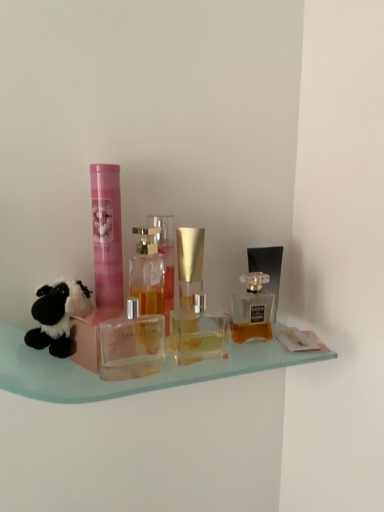
Where is `transparent glass perfume bottle at center, which appears as the third bottle when viewed from the left`? This screenshot has width=384, height=512. transparent glass perfume bottle at center, which appears as the third bottle when viewed from the left is located at coordinates (198, 333).

At what (x,y) coordinates should I click in order to perform the action: click on matte glass perfume bottle at center, positioned as the 4th bottle in left-to-right order. Please return your answer as a coordinate pair (x, y). This screenshot has width=384, height=512. Looking at the image, I should click on (252, 310).

Where is `black plush toy at left`? black plush toy at left is located at coordinates (58, 316).

Locate an element on the screen. Image resolution: width=384 pixels, height=512 pixels. clear glass perfume bottle at center, which is the 1th bottle from left to right is located at coordinates (147, 272).

Where is `transparent glass perfume bottle at center, which appears as the third bottle when viewed from the left`? This screenshot has width=384, height=512. transparent glass perfume bottle at center, which appears as the third bottle when viewed from the left is located at coordinates (198, 333).

Considering the relative positions of clear glass perfume bottle at center, positioned as the fourth bottle in right-to-left order, and matte glass perfume bottle at center, which ranks as the first bottle in right-to-left order, in the image provided, is clear glass perfume bottle at center, positioned as the fourth bottle in right-to-left order, in front of matte glass perfume bottle at center, which ranks as the first bottle in right-to-left order,?

Yes, clear glass perfume bottle at center, positioned as the fourth bottle in right-to-left order, is closer to the viewer.

Is point (141, 275) positioned behind point (252, 322)?

No, it is not.

Is clear glass perfume bottle at center, which is the 1th bottle from left to right, beside matte glass perfume bottle at center, positioned as the 4th bottle in left-to-right order?

No.

Visually, is pink matte tube at center, the second toiletry viewed from the right, positioned to the left or to the right of clear glass perfume bottle at center, which appears as the 3th bottle when viewed from the right?

pink matte tube at center, the second toiletry viewed from the right, is to the left of clear glass perfume bottle at center, which appears as the 3th bottle when viewed from the right.

Is pink matte tube at center, which ranks as the first toiletry in front-to-back order, in contact with clear glass perfume bottle at center, positioned as the second bottle in left-to-right order?

Indeed, pink matte tube at center, which ranks as the first toiletry in front-to-back order, and clear glass perfume bottle at center, positioned as the second bottle in left-to-right order, are beside each other and touching.

Considering the sizes of objects pink matte tube at center, the second toiletry viewed from the right, and clear glass perfume bottle at center, positioned as the second bottle in left-to-right order, in the image provided, who is shorter, pink matte tube at center, the second toiletry viewed from the right, or clear glass perfume bottle at center, positioned as the second bottle in left-to-right order,?

clear glass perfume bottle at center, positioned as the second bottle in left-to-right order, is shorter.

How much distance is there between pink matte tube at center, marked as the 1th toiletry in a left-to-right arrangement, and clear glass perfume bottle at center, which appears as the 3th bottle when viewed from the right?

pink matte tube at center, marked as the 1th toiletry in a left-to-right arrangement, and clear glass perfume bottle at center, which appears as the 3th bottle when viewed from the right, are 3.68 inches apart.

In the scene shown: From a real-world perspective, which is physically below, matte glass perfume bottle at center, positioned as the 4th bottle in left-to-right order, or pink matte tube at center, marked as the 1th toiletry in a left-to-right arrangement?

From a 3D spatial view, matte glass perfume bottle at center, positioned as the 4th bottle in left-to-right order, is below.

Between matte glass perfume bottle at center, which ranks as the first bottle in right-to-left order, and pink matte tube at center, the second toiletry viewed from the right, which one has more height?

With more height is pink matte tube at center, the second toiletry viewed from the right.

Is matte glass perfume bottle at center, which ranks as the first bottle in right-to-left order, closer to the viewer compared to pink matte tube at center, which is the 2th toiletry from back to front?

No.

From a real-world perspective, is clear glass perfume bottle at center, which is the 1th bottle from left to right, under pink matte tube at center, the second toiletry viewed from the right?

Yes.

Is clear glass perfume bottle at center, positioned as the fourth bottle in right-to-left order, directly adjacent to pink matte tube at center, which is the 2th toiletry from back to front?

Yes, clear glass perfume bottle at center, positioned as the fourth bottle in right-to-left order, is beside pink matte tube at center, which is the 2th toiletry from back to front.

Considering the positions of points (164, 271) and (104, 170), is point (164, 271) closer to camera compared to point (104, 170)?

No, it is not.

Is clear glass perfume bottle at center, positioned as the fourth bottle in right-to-left order, not within pink matte tube at center, marked as the 1th toiletry in a left-to-right arrangement?

Absolutely, clear glass perfume bottle at center, positioned as the fourth bottle in right-to-left order, is external to pink matte tube at center, marked as the 1th toiletry in a left-to-right arrangement.

From the image's perspective, does clear glass perfume bottle at center, positioned as the second bottle in left-to-right order, appear higher than black plush toy at left?

Yes.

Can you confirm if clear glass perfume bottle at center, positioned as the second bottle in left-to-right order, is shorter than black plush toy at left?

Incorrect, the height of clear glass perfume bottle at center, positioned as the second bottle in left-to-right order, does not fall short of that of black plush toy at left.

Which object is thinner, clear glass perfume bottle at center, which appears as the 3th bottle when viewed from the right, or black plush toy at left?

clear glass perfume bottle at center, which appears as the 3th bottle when viewed from the right.

From a real-world perspective, is clear glass perfume bottle at center, which appears as the 3th bottle when viewed from the right, positioned under matte black perfume at right, the 1th toiletry from the back, based on gravity?

No.

From the image's perspective, is clear glass perfume bottle at center, which appears as the 3th bottle when viewed from the right, positioned above or below matte black perfume at right, which is counted as the 2th toiletry, starting from the left?

From the image's perspective, clear glass perfume bottle at center, which appears as the 3th bottle when viewed from the right, appears above matte black perfume at right, which is counted as the 2th toiletry, starting from the left.

Could you measure the distance between clear glass perfume bottle at center, positioned as the second bottle in left-to-right order, and matte black perfume at right, the 1th toiletry from the back?

clear glass perfume bottle at center, positioned as the second bottle in left-to-right order, and matte black perfume at right, the 1th toiletry from the back, are 18.67 centimeters apart.

Does point (165, 303) appear closer or farther from the camera than point (248, 250)?

Clearly, point (165, 303) is closer to the camera than point (248, 250).

Based on the photo, considering the sizes of transparent glass perfume bottle at center, which appears as the third bottle when viewed from the left, and clear glass perfume bottle at center, positioned as the second bottle in left-to-right order, in the image, is transparent glass perfume bottle at center, which appears as the third bottle when viewed from the left, wider or thinner than clear glass perfume bottle at center, positioned as the second bottle in left-to-right order,?

Considering their sizes, transparent glass perfume bottle at center, which appears as the third bottle when viewed from the left, looks broader than clear glass perfume bottle at center, positioned as the second bottle in left-to-right order.

In the scene shown: Is transparent glass perfume bottle at center, which is counted as the 2th bottle, starting from the right, oriented away from clear glass perfume bottle at center, positioned as the second bottle in left-to-right order?

Yes.

In terms of size, does transparent glass perfume bottle at center, which appears as the third bottle when viewed from the left, appear bigger or smaller than clear glass perfume bottle at center, which appears as the 3th bottle when viewed from the right?

transparent glass perfume bottle at center, which appears as the third bottle when viewed from the left, is bigger than clear glass perfume bottle at center, which appears as the 3th bottle when viewed from the right.

From the matte glass perfume bottle at center, positioned as the 4th bottle in left-to-right order, count 1st bottles forward and point to it. Please provide its 2D coordinates.

[(147, 272)]

The height and width of the screenshot is (512, 384). Identify the location of toiletry that is above the clear glass perfume bottle at center, positioned as the second bottle in left-to-right order (from the image's perspective). (107, 234).

Based on their spatial positions, is matte glass perfume bottle at center, positioned as the 4th bottle in left-to-right order, or matte black perfume at right, acting as the first toiletry starting from the right, further from transparent glass perfume bottle at center, which appears as the third bottle when viewed from the left?

matte black perfume at right, acting as the first toiletry starting from the right.

Looking at the image, which one is located closer to transparent glass perfume bottle at center, which appears as the third bottle when viewed from the left, clear glass perfume bottle at center, which is the 1th bottle from left to right, or black plush toy at left?

clear glass perfume bottle at center, which is the 1th bottle from left to right, is positioned closer to the anchor transparent glass perfume bottle at center, which appears as the third bottle when viewed from the left.

Looking at the image, which one is located closer to clear glass perfume bottle at center, which appears as the 3th bottle when viewed from the right, clear glass perfume bottle at center, positioned as the fourth bottle in right-to-left order, or pink matte tube at center, the second toiletry viewed from the right?

The object closer to clear glass perfume bottle at center, which appears as the 3th bottle when viewed from the right, is clear glass perfume bottle at center, positioned as the fourth bottle in right-to-left order.

When comparing their distances from clear glass perfume bottle at center, which is the 1th bottle from left to right, does matte black perfume at right, which is counted as the 2th toiletry, starting from the left, or black plush toy at left seem further?

matte black perfume at right, which is counted as the 2th toiletry, starting from the left, lies further to clear glass perfume bottle at center, which is the 1th bottle from left to right, than the other object.

When comparing their distances from matte glass perfume bottle at center, positioned as the 4th bottle in left-to-right order, does black plush toy at left or matte black perfume at right, acting as the first toiletry starting from the right, seem closer?

matte black perfume at right, acting as the first toiletry starting from the right, is positioned closer to the anchor matte glass perfume bottle at center, positioned as the 4th bottle in left-to-right order.

From the image, which object appears to be nearer to matte glass perfume bottle at center, positioned as the 4th bottle in left-to-right order, matte black perfume at right, the 1th toiletry from the back, or transparent glass perfume bottle at center, which is counted as the 2th bottle, starting from the right?

matte black perfume at right, the 1th toiletry from the back, is closer to matte glass perfume bottle at center, positioned as the 4th bottle in left-to-right order.

Looking at the image, which one is located further to pink matte tube at center, which ranks as the first toiletry in front-to-back order, transparent glass perfume bottle at center, which is counted as the 2th bottle, starting from the right, or matte glass perfume bottle at center, which ranks as the first bottle in right-to-left order?

matte glass perfume bottle at center, which ranks as the first bottle in right-to-left order, is positioned further to the anchor pink matte tube at center, which ranks as the first toiletry in front-to-back order.

Which object lies nearer to the anchor point matte black perfume at right, the 1th toiletry from the back, clear glass perfume bottle at center, positioned as the second bottle in left-to-right order, or black plush toy at left?

Based on the image, clear glass perfume bottle at center, positioned as the second bottle in left-to-right order, appears to be nearer to matte black perfume at right, the 1th toiletry from the back.

This screenshot has height=512, width=384. In order to click on toiletry situated between black plush toy at left and matte black perfume at right, the 1th toiletry from the back, from left to right in this screenshot , I will do `click(107, 234)`.

Locate an element on the screen. The height and width of the screenshot is (512, 384). toiletry between black plush toy at left and clear glass perfume bottle at center, which is the 1th bottle from left to right, in the horizontal direction is located at coordinates (107, 234).

Locate an element on the screen. toiletry positioned between clear glass perfume bottle at center, positioned as the fourth bottle in right-to-left order, and clear glass perfume bottle at center, positioned as the second bottle in left-to-right order, from near to far is located at coordinates (107, 234).

Locate an element on the screen. The image size is (384, 512). bottle between clear glass perfume bottle at center, which appears as the 3th bottle when viewed from the right, and matte glass perfume bottle at center, positioned as the 4th bottle in left-to-right order, from left to right is located at coordinates (198, 333).